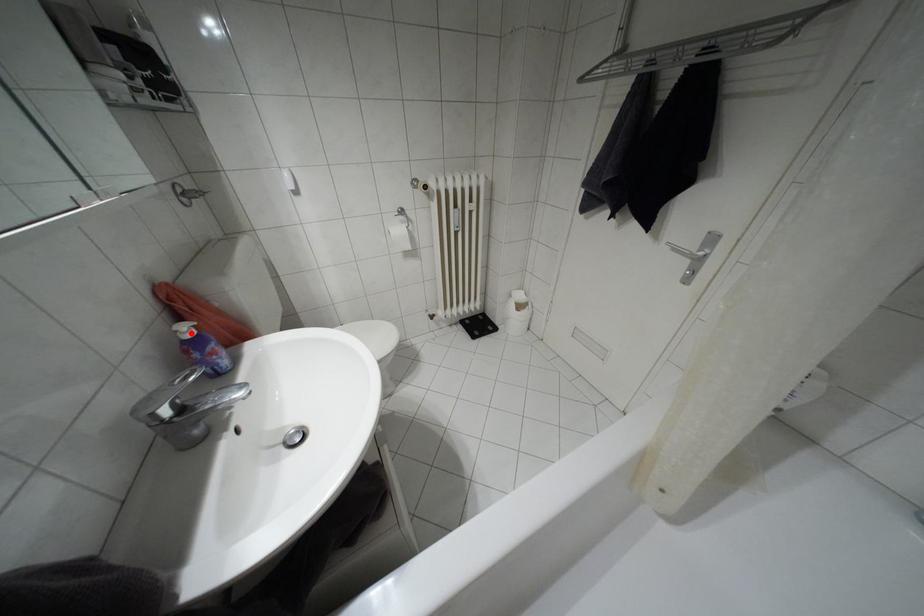
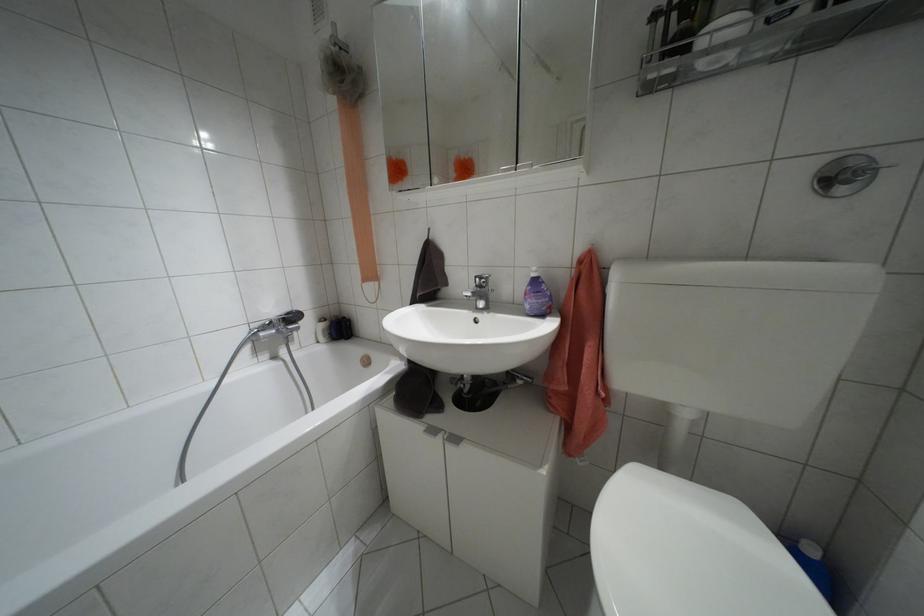
The point at the highlighted location is marked in the first image. Where is the corresponding point in the second image?

(532, 274)